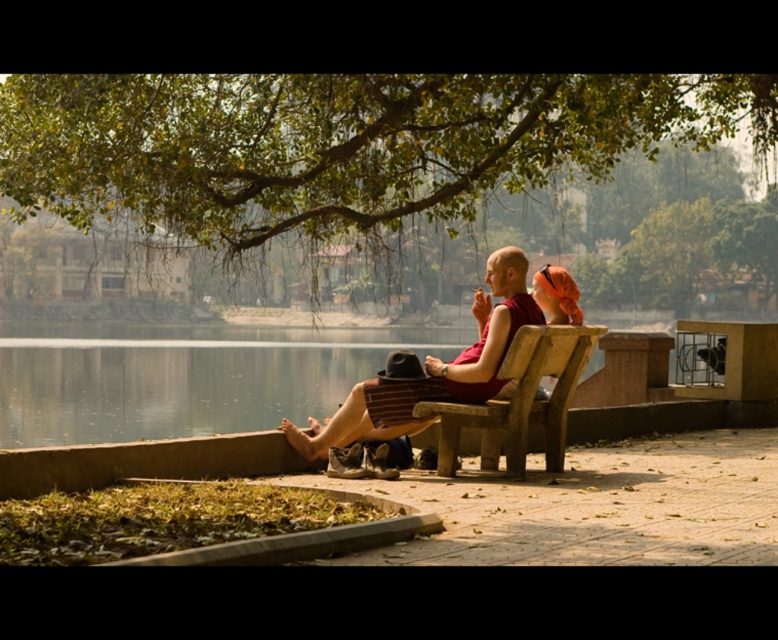
You are standing in the park and see the green leafy tree at upper center and the wooden park bench at center. Which object is higher in the image?

The green leafy tree at upper center is higher than the wooden park bench at center because it is positioned above it in the image.